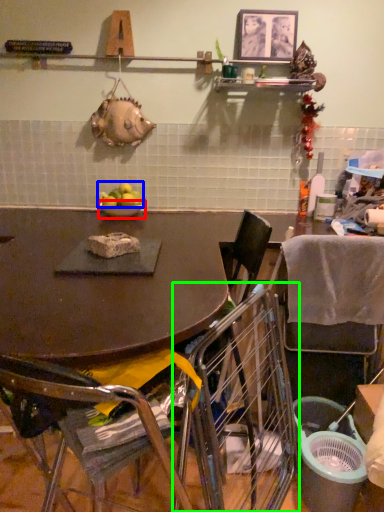
Question: Considering the real-world distances, which object is closest to bowl (highlighted by a red box)? apple (highlighted by a blue box) or chair (highlighted by a green box).

Choices:
 (A) apple
 (B) chair

Answer: (A)